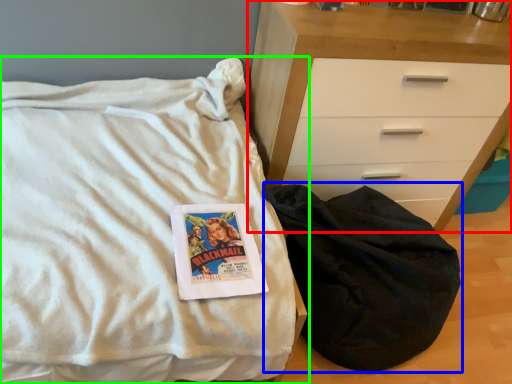
Question: Based on their relative distances, which object is nearer to chest of drawers (highlighted by a red box)? Choose from sleeping bag (highlighted by a blue box) and bed (highlighted by a green box).

Choices:
 (A) sleeping bag
 (B) bed

Answer: (A)